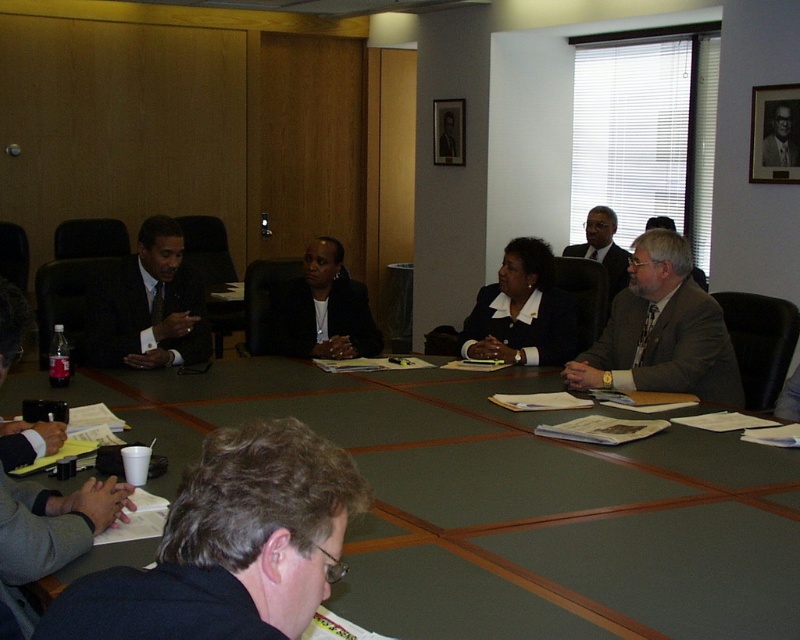
Question: Which of the following is the closest to the observer?

Choices:
 (A) (598, 248)
 (B) (154, 344)
 (C) (778, 125)
 (D) (578, 380)

Answer: (D)

Question: Which point is closer to the camera?

Choices:
 (A) coord(90,333)
 (B) coord(772,132)
 (C) coord(478,324)

Answer: (A)

Question: Is green wood table at center to the left of dark gray suit at left from the viewer's perspective?

Choices:
 (A) yes
 (B) no

Answer: (B)

Question: Which point is closer to the camera?

Choices:
 (A) dark gray suit at left
 (B) dark gray suit at upper right
 (C) green wood table at center

Answer: (C)

Question: Is dark gray suit at center below dark gray suit at upper right?

Choices:
 (A) yes
 (B) no

Answer: (A)

Question: In this image, where is green wood table at center located relative to black matte suit at center?

Choices:
 (A) below
 (B) above

Answer: (A)